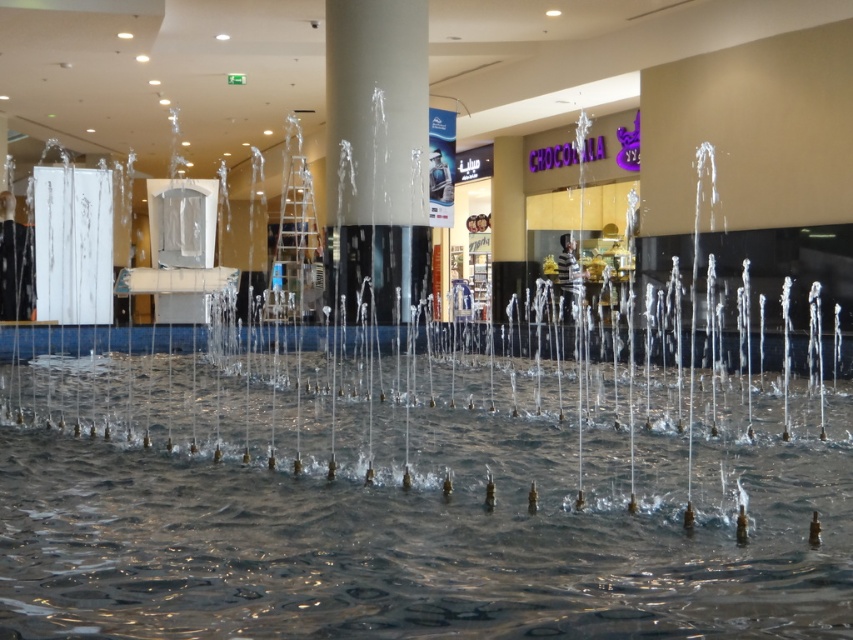
Question: Can you confirm if clear water at center is thinner than white glossy pillar at center?

Choices:
 (A) no
 (B) yes

Answer: (A)

Question: Which of the following is the farthest from the observer?

Choices:
 (A) clear water at center
 (B) white glossy pillar at center

Answer: (B)

Question: Does clear water at center appear under white glossy pillar at center?

Choices:
 (A) no
 (B) yes

Answer: (B)

Question: Does clear water at center have a lesser width compared to white glossy pillar at center?

Choices:
 (A) yes
 (B) no

Answer: (B)

Question: Among these objects, which one is farthest from the camera?

Choices:
 (A) white glossy pillar at center
 (B) clear water at center

Answer: (A)

Question: Which object appears closest to the camera in this image?

Choices:
 (A) clear water at center
 (B) white glossy pillar at center

Answer: (A)